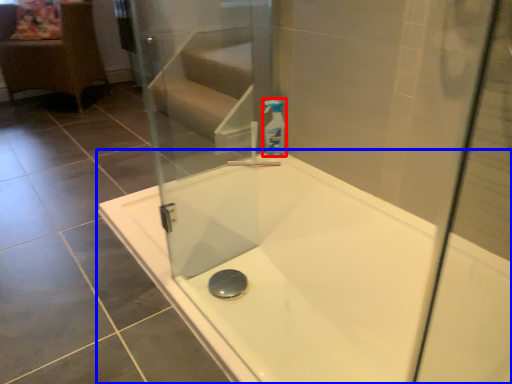
Question: Among these objects, which one is nearest to the camera, cleaning product (highlighted by a red box) or bathtub (highlighted by a blue box)?

Choices:
 (A) cleaning product
 (B) bathtub

Answer: (B)